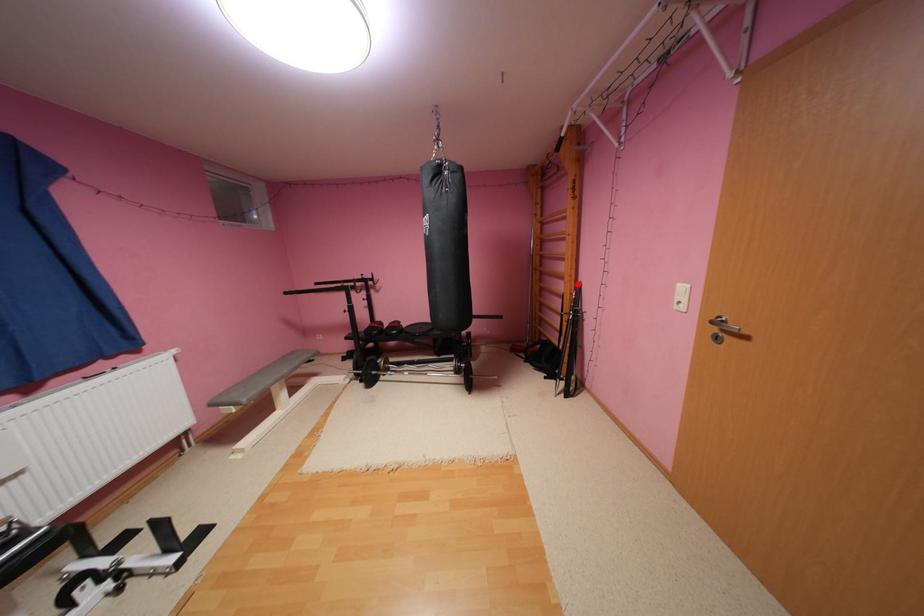
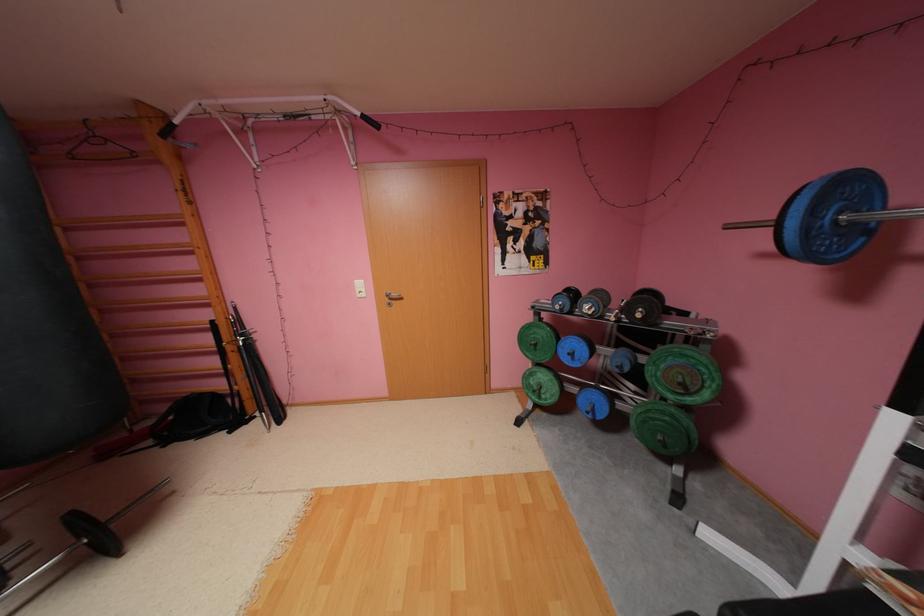
Question: I am providing you with two images of the same scene from different viewpoints. In image1, a red point is highlighted. Considering the same 3D point in image2, which of the following is correct?

Choices:
 (A) It is closer
 (B) It is farther

Answer: (B)